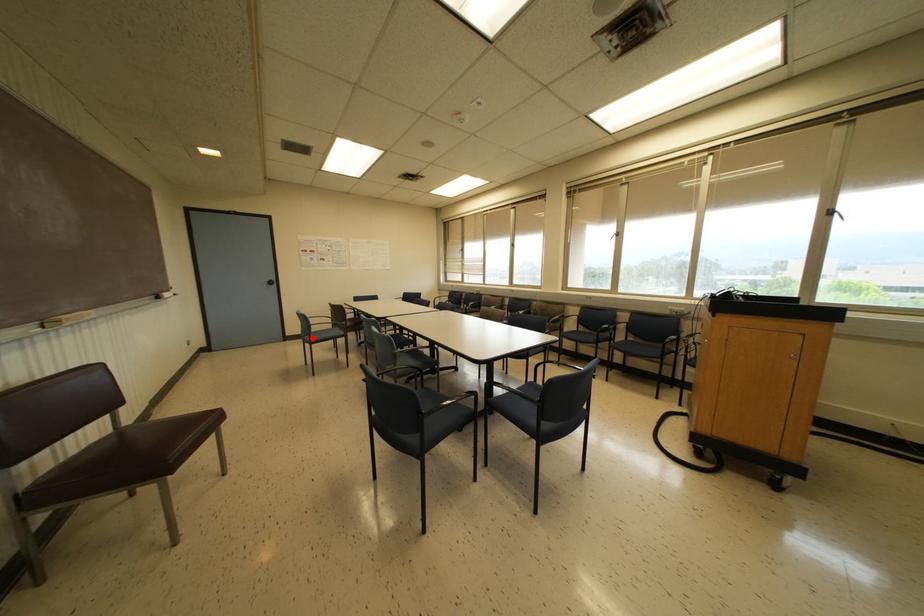
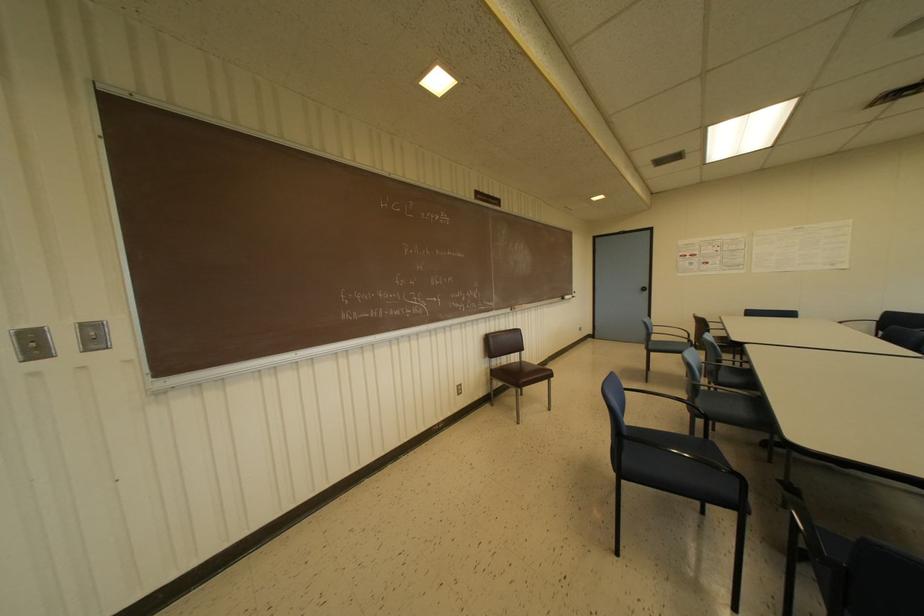
Question: I am providing you with two images of the same scene from different viewpoints. Given a red point in image1, look at the same physical point in image2. Is it:

Choices:
 (A) Closer to the viewpoint
 (B) Farther from the viewpoint

Answer: (A)